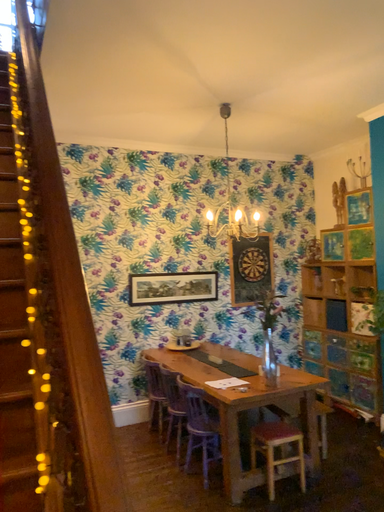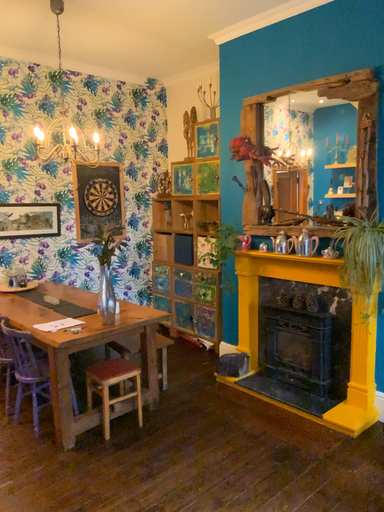
Question: How did the camera likely rotate when shooting the video?

Choices:
 (A) rotated upward
 (B) rotated downward

Answer: (B)